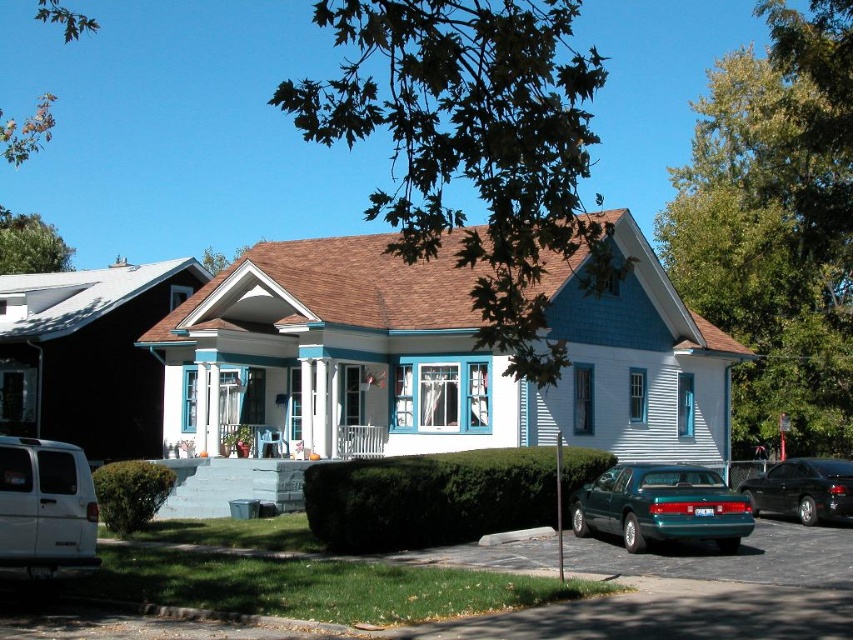
Is teal glossy sedan at lower right behind shiny black sedan at lower right?

That is False.

Between point (639, 477) and point (784, 467), which one is positioned in front?

Positioned in front is point (639, 477).

You are a GUI agent. You are given a task and a screenshot of the screen. Output one action in this format:
    pyautogui.click(x=<x>, y=<y>)
    Task: Click on the teal glossy sedan at lower right
    This screenshot has width=853, height=640.
    Given the screenshot: What is the action you would take?
    pyautogui.click(x=660, y=506)

Can you confirm if teal glossy sedan at lower right is positioned below white matte van at lower left?

Indeed, teal glossy sedan at lower right is positioned under white matte van at lower left.

Measure the distance between teal glossy sedan at lower right and camera.

14.32 meters

I want to click on teal glossy sedan at lower right, so click(660, 506).

Find the location of `teal glossy sedan at lower right`. teal glossy sedan at lower right is located at coordinates [x=660, y=506].

Who is positioned more to the left, white matte van at lower left or shiny black sedan at lower right?

From the viewer's perspective, white matte van at lower left appears more on the left side.

Can you confirm if white matte van at lower left is positioned below shiny black sedan at lower right?

No, white matte van at lower left is not below shiny black sedan at lower right.

Is point (65, 452) farther from camera compared to point (830, 477)?

No, (65, 452) is closer to viewer.

The width and height of the screenshot is (853, 640). I want to click on white matte van at lower left, so click(45, 506).